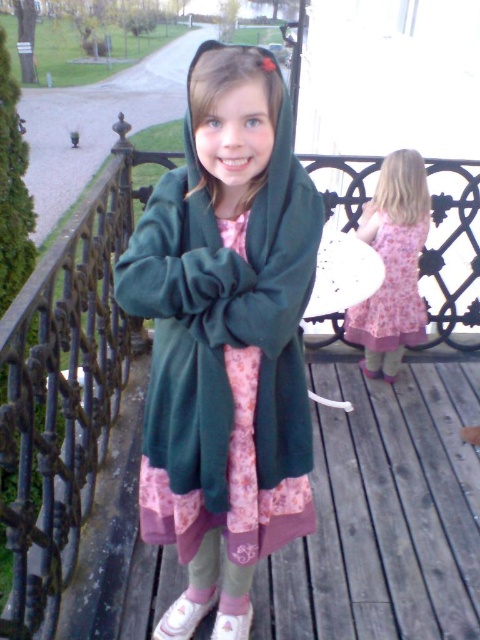
Question: Is dark green fleece coat at center below pink floral dress at center?

Choices:
 (A) yes
 (B) no

Answer: (A)

Question: Considering the relative positions of dark green fleece coat at center and pink floral dress at center in the image provided, where is dark green fleece coat at center located with respect to pink floral dress at center?

Choices:
 (A) right
 (B) left

Answer: (B)

Question: Which point is closer to the camera?

Choices:
 (A) pink floral dress at center
 (B) dark green fleece coat at center

Answer: (B)

Question: Which point is closer to the camera?

Choices:
 (A) pyautogui.click(x=175, y=410)
 (B) pyautogui.click(x=418, y=227)

Answer: (A)

Question: Can you confirm if dark green fleece coat at center is smaller than pink floral dress at center?

Choices:
 (A) yes
 (B) no

Answer: (B)

Question: Which point appears closest to the camera in this image?

Choices:
 (A) (162, 403)
 (B) (384, 160)

Answer: (A)